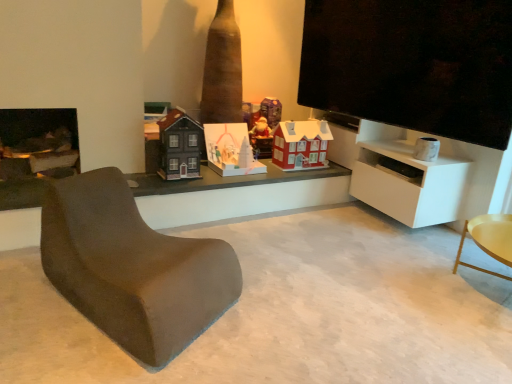
You are a GUI agent. You are given a task and a screenshot of the screen. Output one action in this format:
    pyautogui.click(x=<x>, y=<y>)
    Task: Click on the unoccupied region to the right of matte black house at center, positioned as the 4th toy in right-to-left order
    
    Given the screenshot: What is the action you would take?
    pyautogui.click(x=211, y=178)